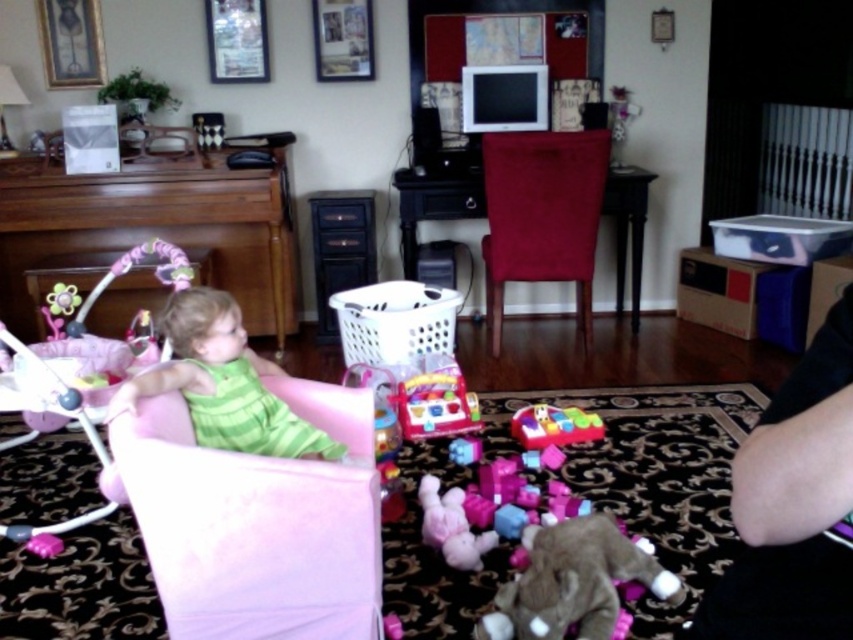
You are a parent trying to choose between placing a new toy either in the green striped fabric baby swing at left or the fluffy pink stuffed animal at lower center. Which object has a larger size?

The green striped fabric baby swing at left is bigger than the fluffy pink stuffed animal at lower center, so the green striped fabric baby swing at left has a larger size.

You are a parent trying to organize the toys in the living room. You have a shelf that can only hold items narrower than the rubberized plastic toy at center. Can the fluffy pink stuffed animal at lower center fit on the shelf?

The fluffy pink stuffed animal at lower center has a lesser width compared to the rubberized plastic toy at center, so it can fit on the shelf since it is narrower than the allowed width.